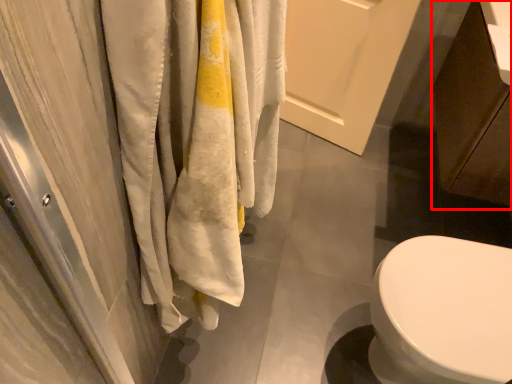
Question: Considering the relative positions of cabinetry (annotated by the red box) and screen door in the image provided, where is cabinetry (annotated by the red box) located with respect to the staircase?

Choices:
 (A) left
 (B) right

Answer: (B)